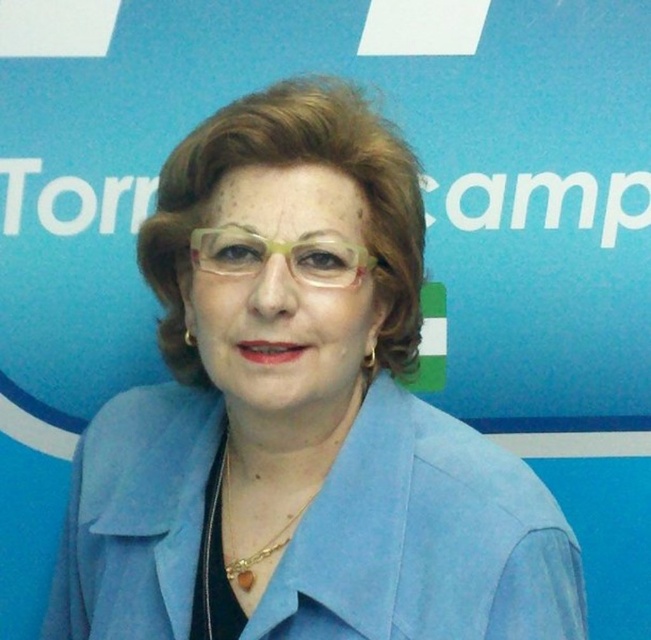
Question: Among these objects, which one is nearest to the camera?

Choices:
 (A) clear plastic glasses at center
 (B) blue suede jacket at center

Answer: (B)

Question: Considering the relative positions of blue suede jacket at center and clear plastic glasses at center in the image provided, where is blue suede jacket at center located with respect to clear plastic glasses at center?

Choices:
 (A) right
 (B) left

Answer: (A)

Question: Among these objects, which one is farthest from the camera?

Choices:
 (A) blue suede jacket at center
 (B) clear plastic glasses at center

Answer: (B)

Question: Is blue suede jacket at center below clear plastic glasses at center?

Choices:
 (A) no
 (B) yes

Answer: (B)

Question: Observing the image, what is the correct spatial positioning of blue suede jacket at center in reference to clear plastic glasses at center?

Choices:
 (A) above
 (B) below

Answer: (B)